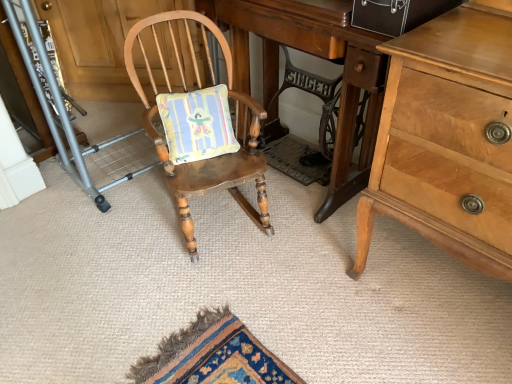
Question: Can you confirm if wooden rocking chair at center is thinner than brushed metal folding chair at left?

Choices:
 (A) no
 (B) yes

Answer: (A)

Question: From the image's perspective, is wooden rocking chair at center below brushed metal folding chair at left?

Choices:
 (A) no
 (B) yes

Answer: (B)

Question: Considering the relative sizes of wooden rocking chair at center and brushed metal folding chair at left in the image provided, is wooden rocking chair at center taller than brushed metal folding chair at left?

Choices:
 (A) no
 (B) yes

Answer: (B)

Question: Can brushed metal folding chair at left be found inside wooden rocking chair at center?

Choices:
 (A) yes
 (B) no

Answer: (B)

Question: Is wooden rocking chair at center far away from brushed metal folding chair at left?

Choices:
 (A) no
 (B) yes

Answer: (A)

Question: Considering the relative sizes of wooden rocking chair at center and brushed metal folding chair at left in the image provided, is wooden rocking chair at center bigger than brushed metal folding chair at left?

Choices:
 (A) yes
 (B) no

Answer: (A)

Question: Can you confirm if brushed metal folding chair at left is bigger than wooden desk at center?

Choices:
 (A) no
 (B) yes

Answer: (A)

Question: Does brushed metal folding chair at left have a greater height compared to wooden desk at center?

Choices:
 (A) no
 (B) yes

Answer: (A)

Question: Considering the relative positions of brushed metal folding chair at left and wooden desk at center in the image provided, is brushed metal folding chair at left to the left of wooden desk at center from the viewer's perspective?

Choices:
 (A) yes
 (B) no

Answer: (A)

Question: Is brushed metal folding chair at left facing away from wooden desk at center?

Choices:
 (A) yes
 (B) no

Answer: (B)

Question: Is brushed metal folding chair at left facing towards wooden desk at center?

Choices:
 (A) no
 (B) yes

Answer: (A)

Question: Does brushed metal folding chair at left have a lesser width compared to wooden desk at center?

Choices:
 (A) no
 (B) yes

Answer: (B)

Question: Can you confirm if wooden rocking chair at center is smaller than wooden desk at center?

Choices:
 (A) yes
 (B) no

Answer: (A)